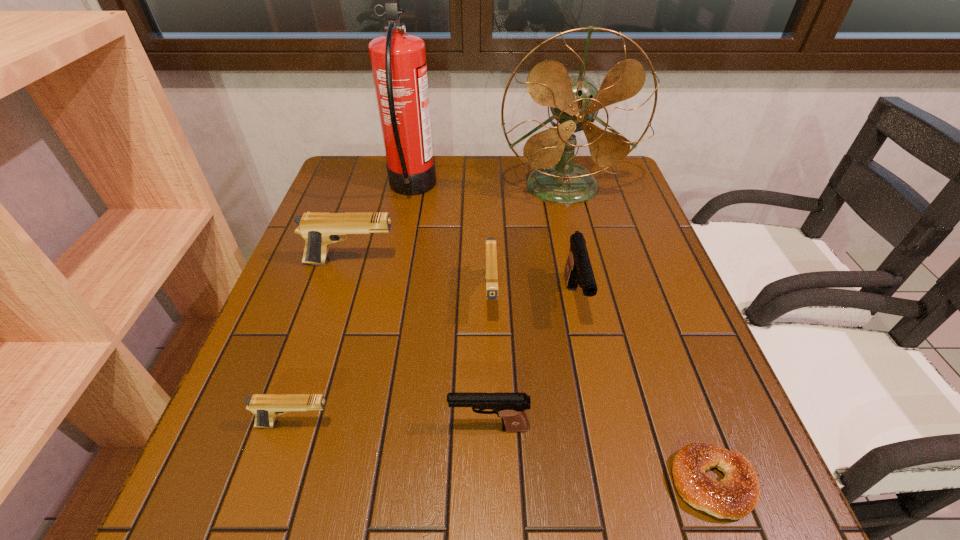
Image resolution: width=960 pixels, height=540 pixels. Find the location of `the shortest pistol`. the shortest pistol is located at coordinates [266, 407].

The height and width of the screenshot is (540, 960). What are the coordinates of `the smallest tan pistol` in the screenshot? It's located at (266, 407).

This screenshot has width=960, height=540. I want to click on the nearest object, so (733, 497).

What are the coordinates of `tan bagel` in the screenshot? It's located at (733, 497).

Where is `vacant space situated 0.320m on the front-facing side of the red fire extinguisher`? vacant space situated 0.320m on the front-facing side of the red fire extinguisher is located at coordinates (543, 188).

This screenshot has height=540, width=960. Identify the location of vacant region located 0.200m in front of the fan, directing air flow. (580, 258).

Identify the location of free space located at the barrel of the farthest tan pistol. This screenshot has height=540, width=960. (446, 262).

I want to click on free space located at the barrel of the bigger black pistol, so click(588, 364).

Locate an element on the screen. vacant space located 0.370m at the barrel of the second farthest tan pistol is located at coordinates [x=496, y=518].

At what (x,y) coordinates should I click in order to perform the action: click on vacant space located at the barrel of the nearer black pistol. Please return your answer as a coordinate pair (x, y). This screenshot has width=960, height=540. Looking at the image, I should click on (220, 427).